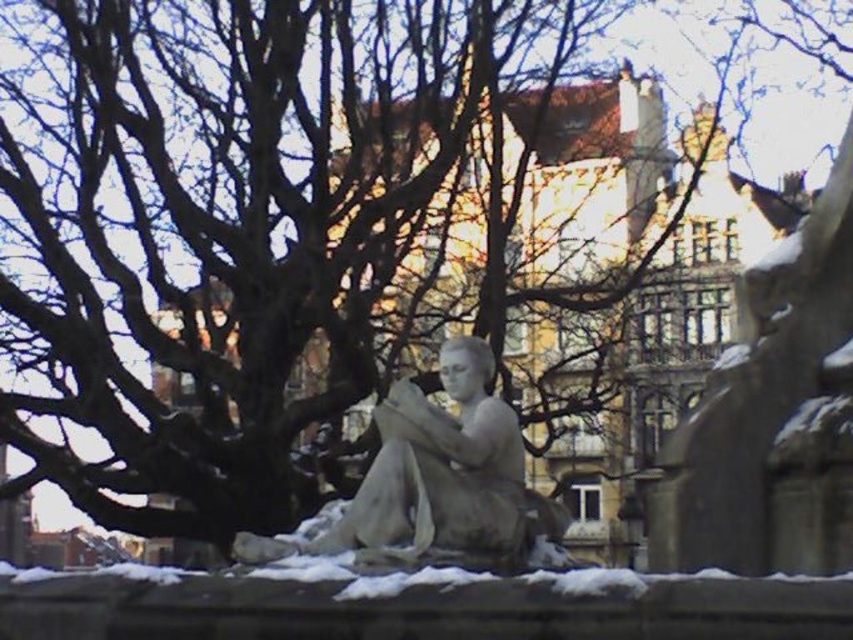
Is point (416, 524) positioned behind point (802, 576)?

Yes, it is behind point (802, 576).

Find the location of a particular element. Image resolution: width=853 pixels, height=640 pixels. white marble statue at center is located at coordinates (436, 477).